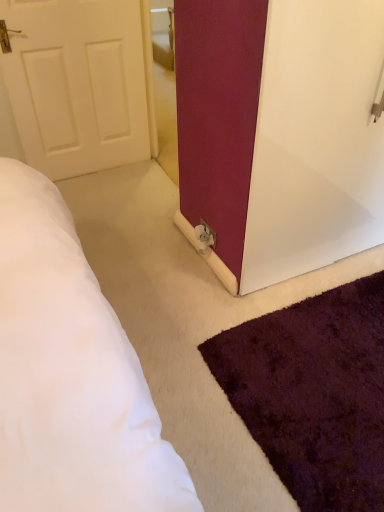
Question: From a real-world perspective, is shaggy purple rug at lower right above or below white glossy door at center?

Choices:
 (A) below
 (B) above

Answer: (A)

Question: Would you say shaggy purple rug at lower right is to the left or to the right of white glossy door at center in the picture?

Choices:
 (A) right
 (B) left

Answer: (A)

Question: Is point (296, 358) positioned closer to the camera than point (246, 257)?

Choices:
 (A) closer
 (B) farther

Answer: (A)

Question: In the image, is white glossy door at center positioned in front of or behind shaggy purple rug at lower right?

Choices:
 (A) front
 (B) behind

Answer: (B)

Question: From a real-world perspective, relative to shaggy purple rug at lower right, is white glossy door at center vertically above or below?

Choices:
 (A) above
 (B) below

Answer: (A)

Question: Based on their sizes in the image, would you say white glossy door at center is bigger or smaller than shaggy purple rug at lower right?

Choices:
 (A) small
 (B) big

Answer: (B)

Question: Is white glossy door at center situated inside shaggy purple rug at lower right or outside?

Choices:
 (A) outside
 (B) inside

Answer: (A)